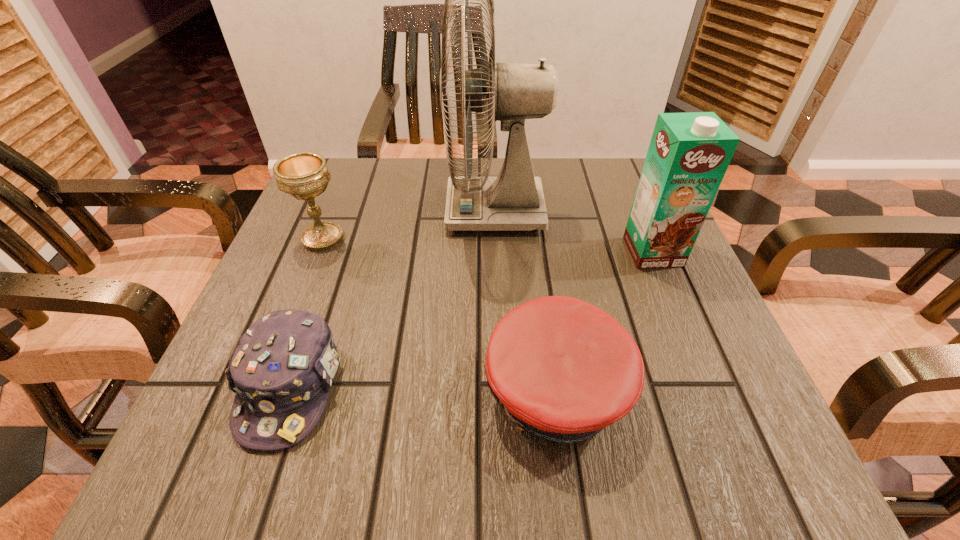
Identify the location of blank area in the image that satisfies the following two spatial constraints: 1. on the front side of the fourth shortest object; 2. on the front-facing side of the right headwear. (710, 390).

Image resolution: width=960 pixels, height=540 pixels. Find the location of `vacant space that satisfies the following two spatial constraints: 1. on the front-facing side of the fan; 2. on the back side of the carton`. vacant space that satisfies the following two spatial constraints: 1. on the front-facing side of the fan; 2. on the back side of the carton is located at coordinates (496, 252).

I want to click on vacant area that satisfies the following two spatial constraints: 1. on the front-facing side of the tallest object; 2. on the front-facing side of the left headwear, so click(x=502, y=386).